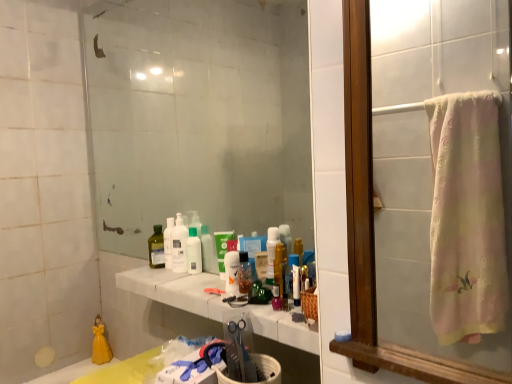
Identify the location of free space to the left of translucent plastic mouthwash at center, marked as the first mouthwash in a back-to-front arrangement. The width and height of the screenshot is (512, 384). (164, 273).